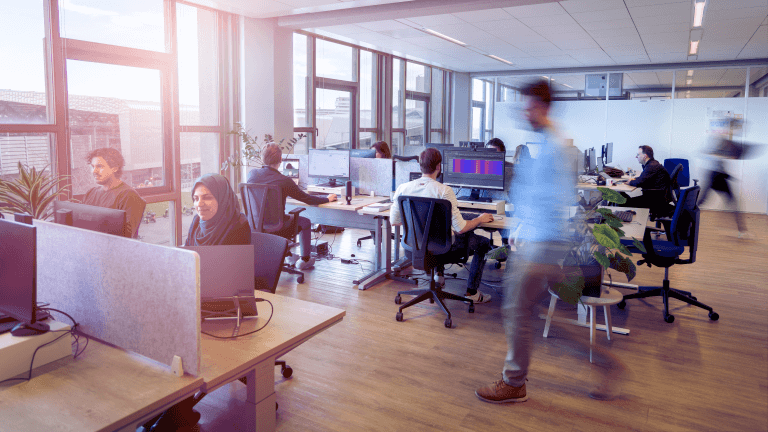
At what (x,y) coordinates should I click in order to perform the action: click on chair. Please return your answer as a coordinate pair (x, y). This screenshot has height=432, width=768. Looking at the image, I should click on (263, 258), (260, 204), (428, 236), (684, 221), (683, 172), (672, 177).